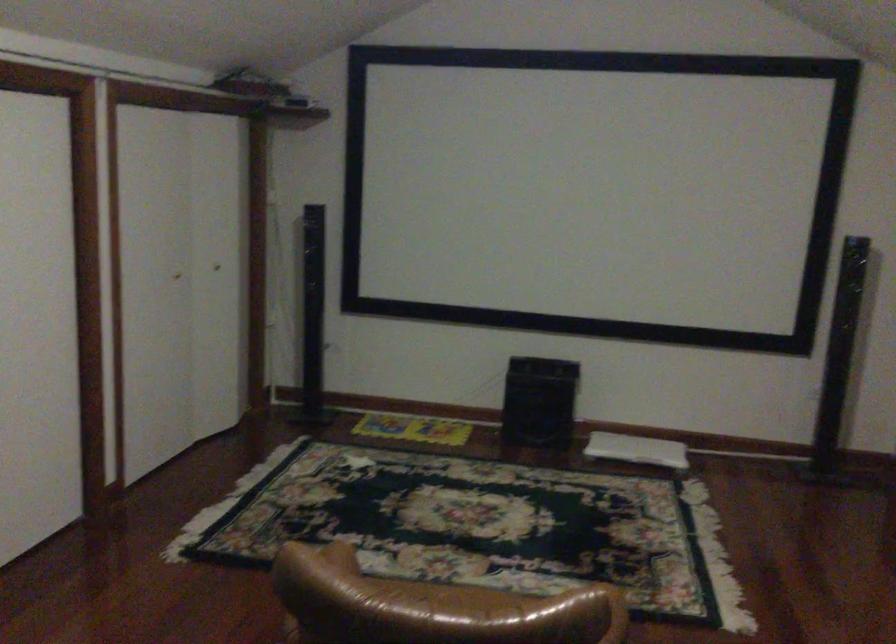
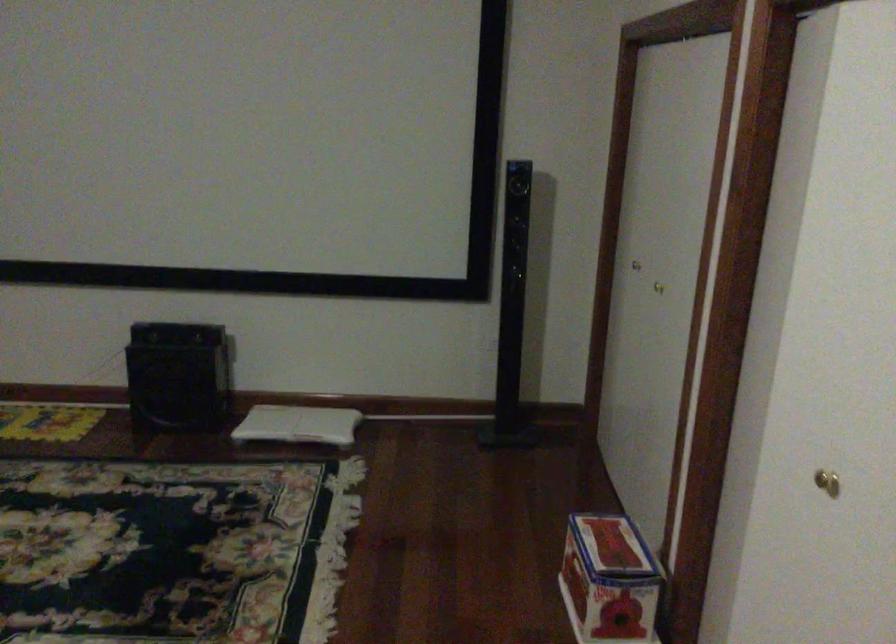
Question: The camera is either moving clockwise (left) or counter-clockwise (right) around the object. The first image is from the beginning of the video and the second image is from the end. Is the camera moving left or right when shooting the video?

Choices:
 (A) Left
 (B) Right

Answer: (A)